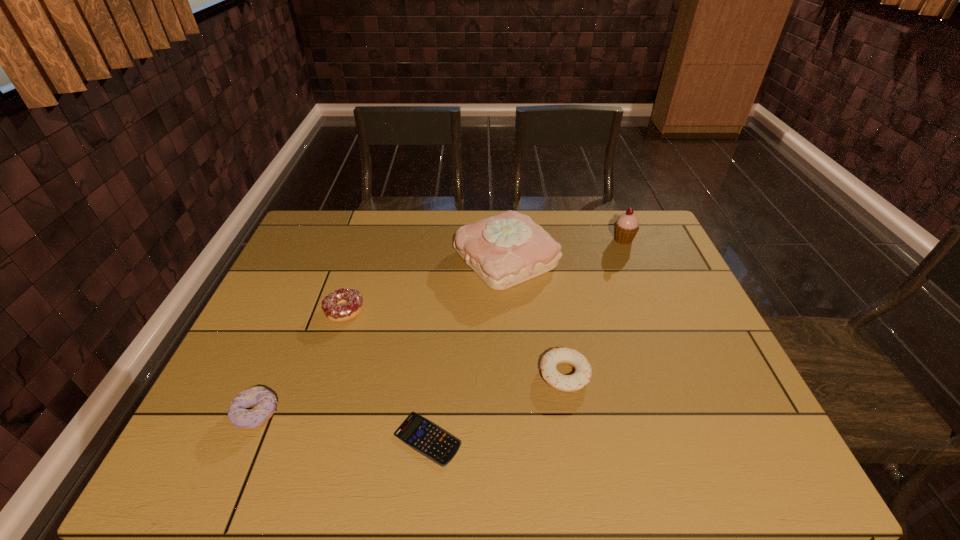
The height and width of the screenshot is (540, 960). In order to click on vacant area situated on the right of the leftmost doughnut in this screenshot , I will do `click(406, 413)`.

I want to click on free space located on the right of the rightmost doughnut, so click(641, 374).

Find the location of a particular element. The width and height of the screenshot is (960, 540). vacant space located on the right of the calculator is located at coordinates (639, 439).

Where is `cupcake that is positioned at the far edge`? cupcake that is positioned at the far edge is located at coordinates (626, 226).

At what (x,y) coordinates should I click in order to perform the action: click on cake present at the far edge. Please return your answer as a coordinate pair (x, y). This screenshot has height=540, width=960. Looking at the image, I should click on (504, 250).

Where is `object present at the near edge`? The image size is (960, 540). object present at the near edge is located at coordinates (422, 435).

Locate an element on the screen. object that is at the left edge is located at coordinates (238, 414).

Find the location of a particular element. This screenshot has width=960, height=540. object at the right edge is located at coordinates (626, 226).

Identify the location of object that is at the far right corner. Image resolution: width=960 pixels, height=540 pixels. (626, 226).

This screenshot has width=960, height=540. What are the coordinates of `vacant space at the far edge` in the screenshot? It's located at (438, 251).